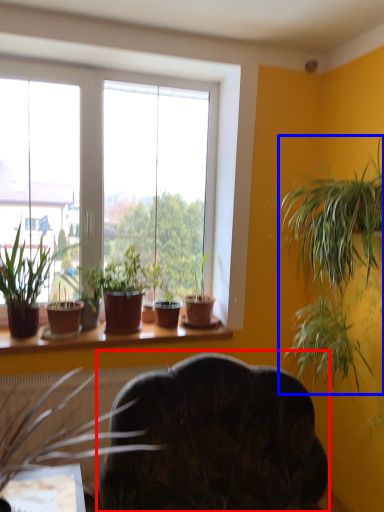
Question: Which point is closer to the camera, swivel chair (highlighted by a red box) or houseplant (highlighted by a blue box)?

Choices:
 (A) swivel chair
 (B) houseplant

Answer: (A)